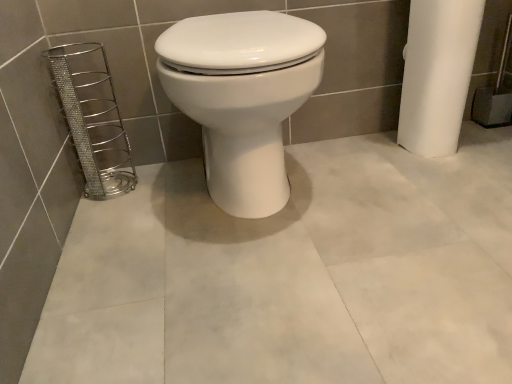
You are a GUI agent. You are given a task and a screenshot of the screen. Output one action in this format:
    pyautogui.click(x=<x>, y=<y>)
    Task: Click on the vacant space in white glossy toilet at center (from a real-world perspective)
    This screenshot has width=512, height=384.
    Given the screenshot: What is the action you would take?
    pyautogui.click(x=260, y=209)